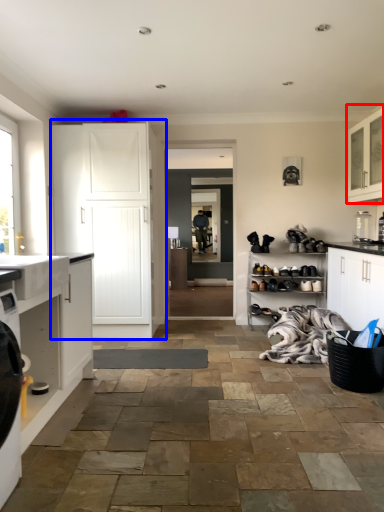
Question: Which point is closer to the camera, cabinetry (highlighted by a red box) or cabinetry (highlighted by a blue box)?

Choices:
 (A) cabinetry
 (B) cabinetry

Answer: (A)